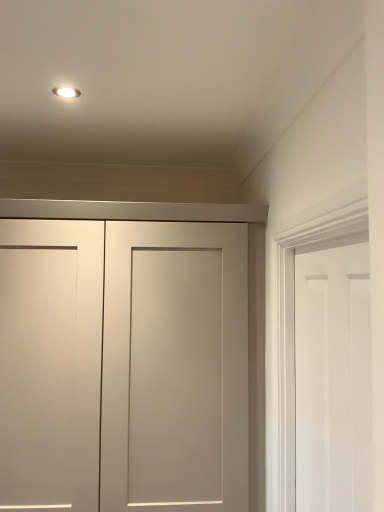
Question: Is matte white cabinet at center, arranged as the 2th door when viewed from the right, inside the boundaries of white matte door at right, the 1th door when ordered from front to back, or outside?

Choices:
 (A) outside
 (B) inside

Answer: (A)

Question: Relative to white matte door at right, the 1th door when ordered from front to back, is matte white cabinet at center, arranged as the 2th door when viewed from the right, in front or behind?

Choices:
 (A) front
 (B) behind

Answer: (B)

Question: Looking at the image, does matte white cabinet at center, the 1th door when ordered from back to front, seem bigger or smaller compared to white matte door at right, the 1th door when ordered from front to back?

Choices:
 (A) small
 (B) big

Answer: (B)

Question: From the image's perspective, relative to matte white cabinet at center, marked as the 2th door in a front-to-back arrangement, is white matte door at right, the 1th door when ordered from front to back, above or below?

Choices:
 (A) above
 (B) below

Answer: (A)

Question: Is point (311, 258) positioned closer to the camera than point (168, 394)?

Choices:
 (A) farther
 (B) closer

Answer: (B)

Question: Is white matte door at right, marked as the 2th door in a back-to-front arrangement, to the left or to the right of matte white cabinet at center, the 1th door when ordered from back to front, in the image?

Choices:
 (A) right
 (B) left

Answer: (A)

Question: Is white matte door at right, marked as the 2th door in a back-to-front arrangement, wider or thinner than matte white cabinet at center, placed as the 1th door when sorted from left to right?

Choices:
 (A) thin
 (B) wide

Answer: (A)